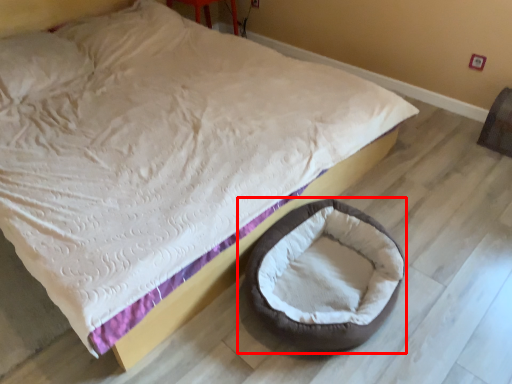
Question: Considering the relative positions of dog bed (annotated by the red box) and bean bag chair in the image provided, where is dog bed (annotated by the red box) located with respect to the staircase?

Choices:
 (A) left
 (B) right

Answer: (A)